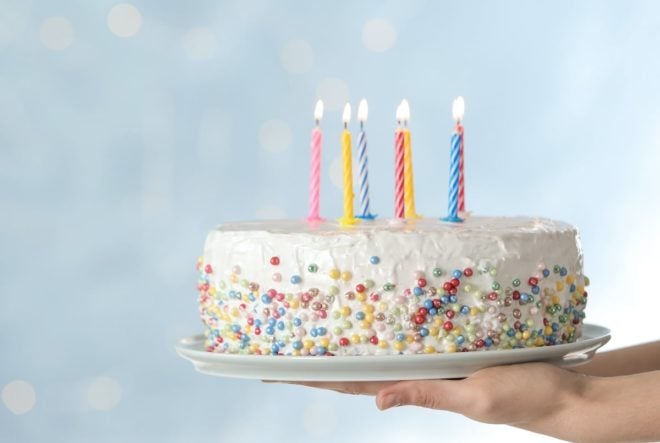
Find the location of a particular element. Image resolution: width=660 pixels, height=443 pixels. birthday candle wax catcher is located at coordinates (310, 219), (341, 222), (364, 216), (391, 220), (411, 219), (439, 218), (465, 213).